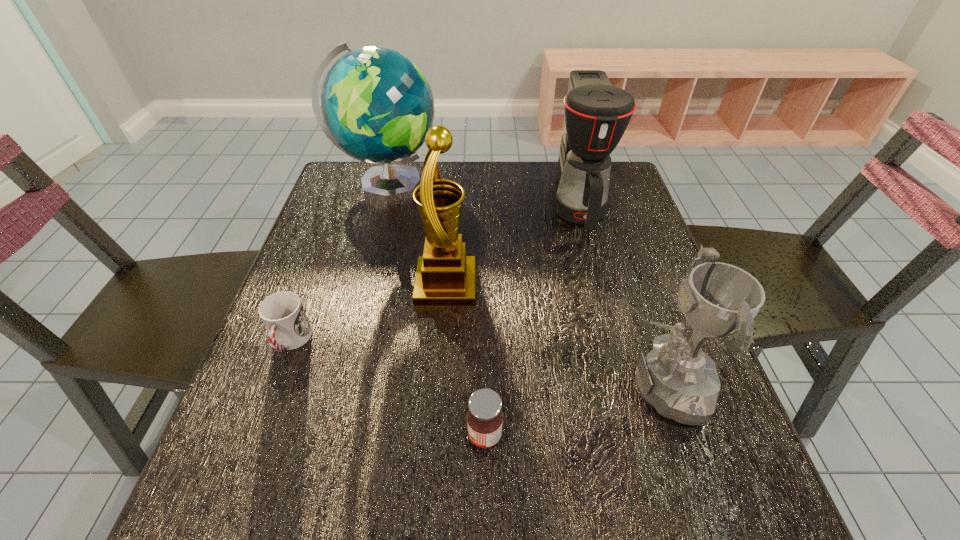
Identify the location of globe. (376, 106).

The height and width of the screenshot is (540, 960). What are the coordinates of `the farther award` in the screenshot? It's located at (445, 277).

This screenshot has height=540, width=960. What are the coordinates of `the third farthest object` in the screenshot? It's located at (445, 277).

I want to click on coffee maker, so pyautogui.click(x=597, y=114).

Locate an element on the screen. the right award is located at coordinates (678, 379).

Identify the location of the nearer award. Image resolution: width=960 pixels, height=540 pixels. coord(678,379).

The width and height of the screenshot is (960, 540). What are the coordinates of `jam` in the screenshot? It's located at (484, 417).

Image resolution: width=960 pixels, height=540 pixels. In order to click on the shortest object in this screenshot , I will do `click(282, 313)`.

This screenshot has width=960, height=540. I want to click on free space located on the front surface of the globe, so click(x=468, y=185).

At what (x,y) coordinates should I click in order to perform the action: click on free point located 0.170m on the front-facing side of the left award. Please return your answer as a coordinate pair (x, y). This screenshot has width=960, height=540. Looking at the image, I should click on (551, 286).